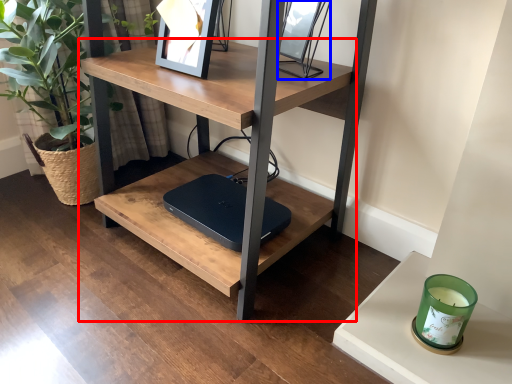
Question: Which point is closer to the camera, table (highlighted by a red box) or picture frame (highlighted by a blue box)?

Choices:
 (A) table
 (B) picture frame

Answer: (A)